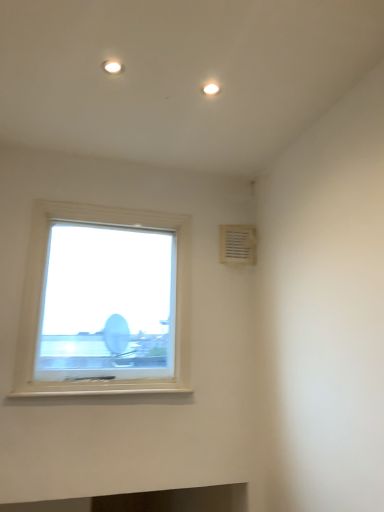
What do you see at coordinates (105, 303) in the screenshot? I see `white plastic window at upper left` at bounding box center [105, 303].

The width and height of the screenshot is (384, 512). What are the coordinates of `white plastic window at upper left` in the screenshot? It's located at (105, 303).

This screenshot has width=384, height=512. Identify the location of white plastic vent at upper right. (237, 244).

Image resolution: width=384 pixels, height=512 pixels. What do you see at coordinates (237, 244) in the screenshot? I see `white plastic vent at upper right` at bounding box center [237, 244].

The image size is (384, 512). In order to click on white plastic window at upper left in this screenshot , I will do `click(105, 303)`.

Considering the positions of objects white plastic vent at upper right and white plastic window at upper left in the image provided, who is more to the right, white plastic vent at upper right or white plastic window at upper left?

white plastic vent at upper right.

From the picture: Does white plastic vent at upper right come in front of white plastic window at upper left?

No, the depth of white plastic vent at upper right is greater than that of white plastic window at upper left.

Which point is more forward, (232, 244) or (141, 318)?

The point (141, 318) is closer.

From the image's perspective, between white plastic vent at upper right and white plastic window at upper left, which one is located above?

white plastic vent at upper right appears higher in the image.

From a real-world perspective, who is located lower, white plastic vent at upper right or white plastic window at upper left?

From a 3D spatial view, white plastic window at upper left is below.

In the scene shown: Considering the sizes of white plastic vent at upper right and white plastic window at upper left in the image, is white plastic vent at upper right wider or thinner than white plastic window at upper left?

Clearly, white plastic vent at upper right has less width compared to white plastic window at upper left.

In terms of height, does white plastic vent at upper right look taller or shorter compared to white plastic window at upper left?

Considering their sizes, white plastic vent at upper right has less height than white plastic window at upper left.

Is white plastic vent at upper right bigger or smaller than white plastic window at upper left?

Clearly, white plastic vent at upper right is smaller in size than white plastic window at upper left.

Would you say white plastic vent at upper right is outside white plastic window at upper left?

Absolutely, white plastic vent at upper right is external to white plastic window at upper left.

Is white plastic vent at upper right far away from white plastic window at upper left?

No, white plastic vent at upper right is not far away from white plastic window at upper left.

Based on the photo, is white plastic vent at upper right oriented towards white plastic window at upper left?

No, white plastic vent at upper right is not facing towards white plastic window at upper left.

Locate an element on the screen. The height and width of the screenshot is (512, 384). air conditioning above the white plastic window at upper left (from the image's perspective) is located at coordinates (237, 244).

Considering the positions of objects white plastic window at upper left and white plastic vent at upper right in the image provided, who is more to the left, white plastic window at upper left or white plastic vent at upper right?

white plastic window at upper left.

Considering the positions of objects white plastic window at upper left and white plastic vent at upper right in the image provided, who is in front, white plastic window at upper left or white plastic vent at upper right?

white plastic window at upper left is closer to the camera.

Which is behind, point (118, 309) or point (250, 233)?

Positioned behind is point (250, 233).

From the image's perspective, which one is positioned higher, white plastic window at upper left or white plastic vent at upper right?

white plastic vent at upper right.

From a real-world perspective, is white plastic window at upper left positioned over white plastic vent at upper right based on gravity?

Actually, white plastic window at upper left is physically below white plastic vent at upper right in the real world.

Can you confirm if white plastic window at upper left is thinner than white plastic vent at upper right?

No.

Is white plastic window at upper left taller or shorter than white plastic vent at upper right?

white plastic window at upper left is taller than white plastic vent at upper right.

Does white plastic window at upper left have a smaller size compared to white plastic vent at upper right?

Actually, white plastic window at upper left might be larger than white plastic vent at upper right.

Would you say white plastic window at upper left is outside white plastic vent at upper right?

white plastic window at upper left lies outside white plastic vent at upper right's area.

Is white plastic window at upper left far from white plastic vent at upper right?

white plastic window at upper left is near white plastic vent at upper right, not far away.

Is white plastic vent at upper right at the back of white plastic window at upper left?

white plastic window at upper left does not have its back to white plastic vent at upper right.

At what (x,y) coordinates should I click in order to perform the action: click on window in front of the white plastic vent at upper right. Please return your answer as a coordinate pair (x, y). Looking at the image, I should click on (105, 303).

I want to click on window located underneath the white plastic vent at upper right (from a real-world perspective), so click(x=105, y=303).

At what (x,y) coordinates should I click in order to perform the action: click on air conditioning lying above the white plastic window at upper left (from the image's perspective). Please return your answer as a coordinate pair (x, y). Image resolution: width=384 pixels, height=512 pixels. Looking at the image, I should click on (237, 244).